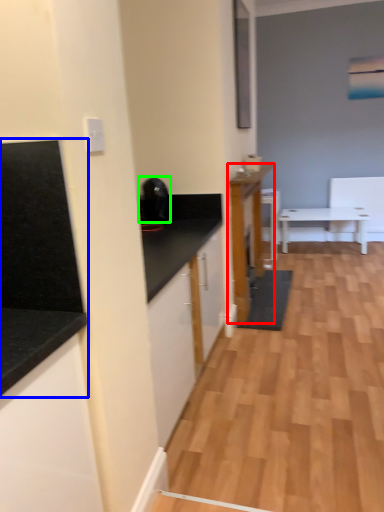
Question: Which object is positioned farthest from cabinetry (highlighted by a red box)? Select from countertop (highlighted by a blue box) and appliance (highlighted by a green box).

Choices:
 (A) countertop
 (B) appliance

Answer: (A)